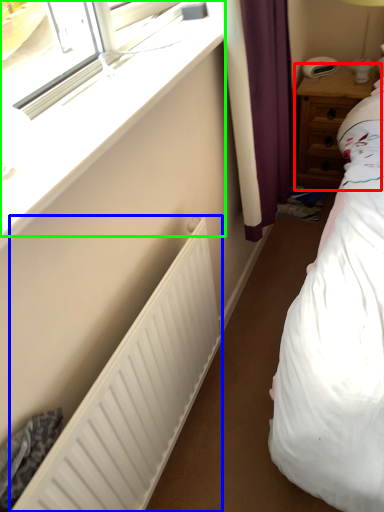
Question: Which object is positioned closest to nightstand (highlighted by a red box)? Select from radiator (highlighted by a blue box) and window (highlighted by a green box).

Choices:
 (A) radiator
 (B) window

Answer: (B)